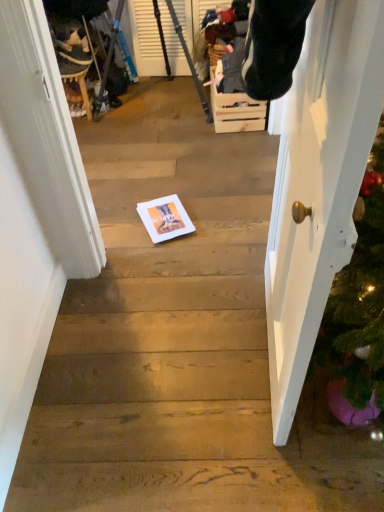
Question: Are white paper at center and wooden crate at center beside each other?

Choices:
 (A) no
 (B) yes

Answer: (A)

Question: Is white paper at center at the left side of wooden crate at center?

Choices:
 (A) no
 (B) yes

Answer: (B)

Question: From the image's perspective, is white paper at center located beneath wooden crate at center?

Choices:
 (A) no
 (B) yes

Answer: (B)

Question: Is white paper at center in front of wooden crate at center?

Choices:
 (A) no
 (B) yes

Answer: (B)

Question: Considering the relative sizes of white paper at center and wooden crate at center in the image provided, is white paper at center taller than wooden crate at center?

Choices:
 (A) no
 (B) yes

Answer: (A)

Question: Is white paper at center in front of or behind velvet plush toy at upper left in the image?

Choices:
 (A) front
 (B) behind

Answer: (A)

Question: From a real-world perspective, is white paper at center physically located above or below velvet plush toy at upper left?

Choices:
 (A) below
 (B) above

Answer: (A)

Question: Looking at the image, does white paper at center seem bigger or smaller compared to velvet plush toy at upper left?

Choices:
 (A) big
 (B) small

Answer: (B)

Question: Looking at their shapes, would you say white paper at center is wider or thinner than velvet plush toy at upper left?

Choices:
 (A) wide
 (B) thin

Answer: (A)

Question: From a real-world perspective, relative to white glossy door at right, is white paper at center vertically above or below?

Choices:
 (A) above
 (B) below

Answer: (B)

Question: Is white paper at center inside the boundaries of white glossy door at right, or outside?

Choices:
 (A) outside
 (B) inside

Answer: (A)

Question: Does point (190, 223) appear closer or farther from the camera than point (340, 59)?

Choices:
 (A) closer
 (B) farther

Answer: (B)

Question: Looking at the image, does white paper at center seem bigger or smaller compared to white glossy door at right?

Choices:
 (A) big
 (B) small

Answer: (B)

Question: Considering the relative positions of metallic tripod at upper left and white paper at center in the image provided, is metallic tripod at upper left to the left or to the right of white paper at center?

Choices:
 (A) left
 (B) right

Answer: (A)

Question: Considering the positions of point (192, 73) and point (153, 205), is point (192, 73) closer or farther from the camera than point (153, 205)?

Choices:
 (A) closer
 (B) farther

Answer: (B)